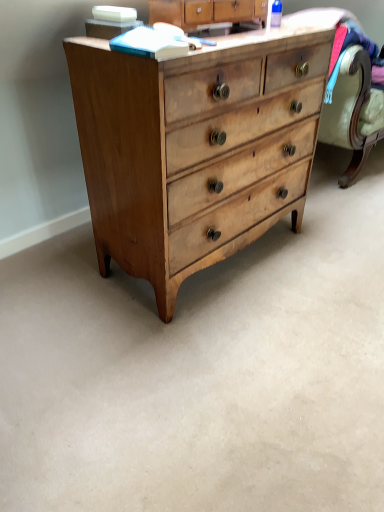
Where is `light brown wood chest of drawers at center`? Image resolution: width=384 pixels, height=512 pixels. light brown wood chest of drawers at center is located at coordinates (195, 148).

The image size is (384, 512). What do you see at coordinates (195, 148) in the screenshot?
I see `light brown wood chest of drawers at center` at bounding box center [195, 148].

Describe the element at coordinates (207, 12) in the screenshot. The width and height of the screenshot is (384, 512). I see `light brown wood dresser at upper center` at that location.

This screenshot has height=512, width=384. Identify the location of light brown wood dresser at upper center. (207, 12).

The height and width of the screenshot is (512, 384). In order to click on light brown wood chest of drawers at center in this screenshot , I will do `click(195, 148)`.

Visually, is light brown wood chest of drawers at center positioned to the left or to the right of light brown wood dresser at upper center?

Clearly, light brown wood chest of drawers at center is on the left of light brown wood dresser at upper center in the image.

Considering the relative positions of light brown wood chest of drawers at center and light brown wood dresser at upper center in the image provided, is light brown wood chest of drawers at center behind light brown wood dresser at upper center?

No, the depth of light brown wood chest of drawers at center is less than that of light brown wood dresser at upper center.

Does point (183, 72) lie behind point (158, 0)?

That is False.

From the image's perspective, does light brown wood chest of drawers at center appear lower than light brown wood dresser at upper center?

Yes.

From a real-world perspective, which object stands above the other?

light brown wood dresser at upper center, from a real-world perspective.

Looking at their sizes, would you say light brown wood chest of drawers at center is wider or thinner than light brown wood dresser at upper center?

light brown wood chest of drawers at center is wider than light brown wood dresser at upper center.

Is light brown wood chest of drawers at center taller or shorter than light brown wood dresser at upper center?

Considering their sizes, light brown wood chest of drawers at center has more height than light brown wood dresser at upper center.

Who is bigger, light brown wood chest of drawers at center or light brown wood dresser at upper center?

Bigger between the two is light brown wood chest of drawers at center.

Is light brown wood dresser at upper center surrounded by light brown wood chest of drawers at center?

No, light brown wood dresser at upper center is not a part of light brown wood chest of drawers at center.

Would you say light brown wood chest of drawers at center is a long distance from light brown wood dresser at upper center?

They are positioned close to each other.

In the scene shown: Could you tell me if light brown wood chest of drawers at center is facing light brown wood dresser at upper center?

No, light brown wood chest of drawers at center is not facing towards light brown wood dresser at upper center.

Based on the photo, how much distance is there between light brown wood chest of drawers at center and light brown wood dresser at upper center?

They are 47.39 centimeters apart.

Identify the location of the chest of drawers below the light brown wood dresser at upper center (from a real-world perspective). [195, 148].

In the image, is light brown wood dresser at upper center on the left side or the right side of light brown wood chest of drawers at center?

Clearly, light brown wood dresser at upper center is on the right of light brown wood chest of drawers at center in the image.

Based on the photo, relative to light brown wood chest of drawers at center, is light brown wood dresser at upper center in front or behind?

light brown wood dresser at upper center is behind light brown wood chest of drawers at center.

Is point (211, 11) closer to viewer compared to point (146, 262)?

Yes.

From the image's perspective, between light brown wood dresser at upper center and light brown wood chest of drawers at center, who is located below?

light brown wood chest of drawers at center appears lower in the image.

From a real-world perspective, does light brown wood dresser at upper center sit lower than light brown wood chest of drawers at center?

No, from a real-world perspective, light brown wood dresser at upper center is not below light brown wood chest of drawers at center.

Between light brown wood dresser at upper center and light brown wood chest of drawers at center, which one has smaller width?

With smaller width is light brown wood dresser at upper center.

From their relative heights in the image, would you say light brown wood dresser at upper center is taller or shorter than light brown wood chest of drawers at center?

Considering their sizes, light brown wood dresser at upper center has less height than light brown wood chest of drawers at center.

Which of these two, light brown wood dresser at upper center or light brown wood chest of drawers at center, is bigger?

light brown wood chest of drawers at center.

Is light brown wood chest of drawers at center located within light brown wood dresser at upper center?

No, light brown wood chest of drawers at center is not a part of light brown wood dresser at upper center.

Is light brown wood dresser at upper center far away from light brown wood chest of drawers at center?

No.

Could you tell me if light brown wood dresser at upper center is turned towards light brown wood chest of drawers at center?

No, light brown wood dresser at upper center is not turned towards light brown wood chest of drawers at center.

How different are the orientations of light brown wood dresser at upper center and light brown wood chest of drawers at center in degrees?

They differ by 0.258 degrees in their facing directions.

Measure the distance from light brown wood dresser at upper center to light brown wood chest of drawers at center.

light brown wood dresser at upper center is 18.66 inches from light brown wood chest of drawers at center.

You are a GUI agent. You are given a task and a screenshot of the screen. Output one action in this format:
    pyautogui.click(x=<x>, y=<y>)
    Task: Click on the chest of drawers below the light brown wood dresser at upper center (from a real-world perspective)
    
    Given the screenshot: What is the action you would take?
    pyautogui.click(x=195, y=148)

Where is `cabinetry above the light brown wood chest of drawers at center (from the image's perspective)`? The image size is (384, 512). cabinetry above the light brown wood chest of drawers at center (from the image's perspective) is located at coordinates (207, 12).

Image resolution: width=384 pixels, height=512 pixels. In order to click on the chest of drawers that is under the light brown wood dresser at upper center (from a real-world perspective) in this screenshot , I will do `click(195, 148)`.